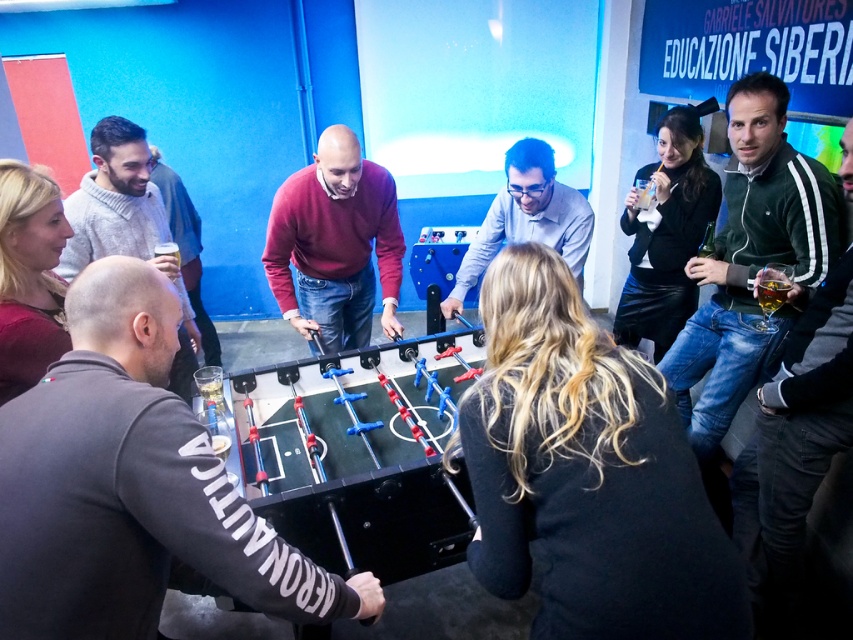
You are a person standing in the middle of the room. You want to grab a drink from the table behind the EDUCAZIONE S. sign on the wall. The coordinates of the EDUCAZIONE S. sign are at point (335, 243). Which object should you look for to find the drink?

The point (335, 243) indicates the maroon sweater at center, so you should look for the maroon sweater at center to find the drink.

You are organizing a charity event and need to decide which of the two sweaters, the maroon sweater at center or the dark gray sweater at lower left, would be more suitable for a display stand that requires a wider garment. Based on the image, which sweater should you choose?

The maroon sweater at center is wider than the dark gray sweater at lower left, so it would be more suitable for the display stand requiring a wider garment.